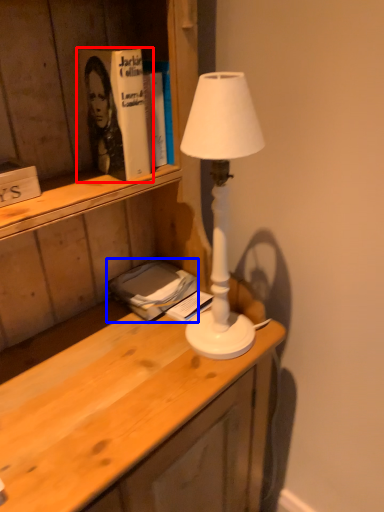
Question: Which object appears farthest to the camera in this image, paperback book (highlighted by a red box) or book (highlighted by a blue box)?

Choices:
 (A) paperback book
 (B) book

Answer: (B)